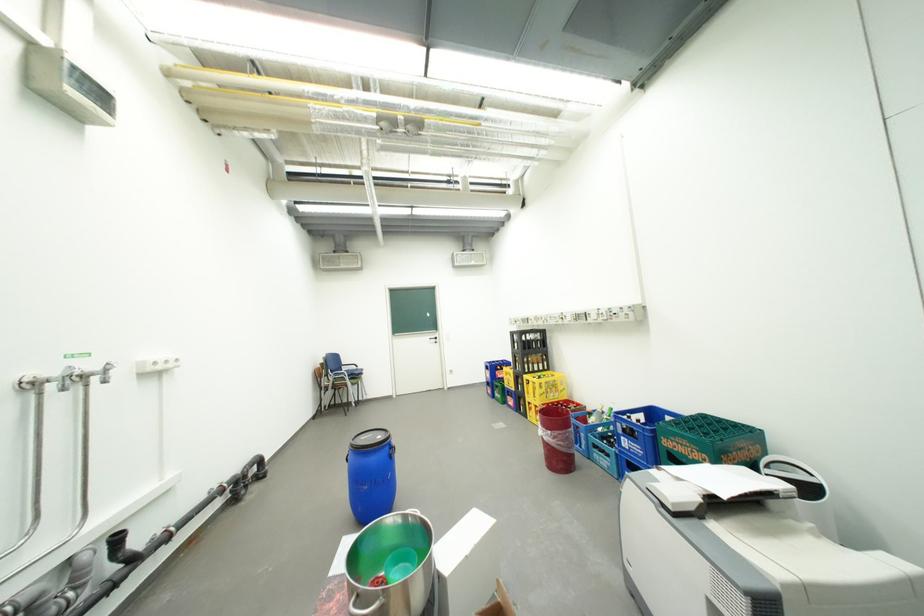
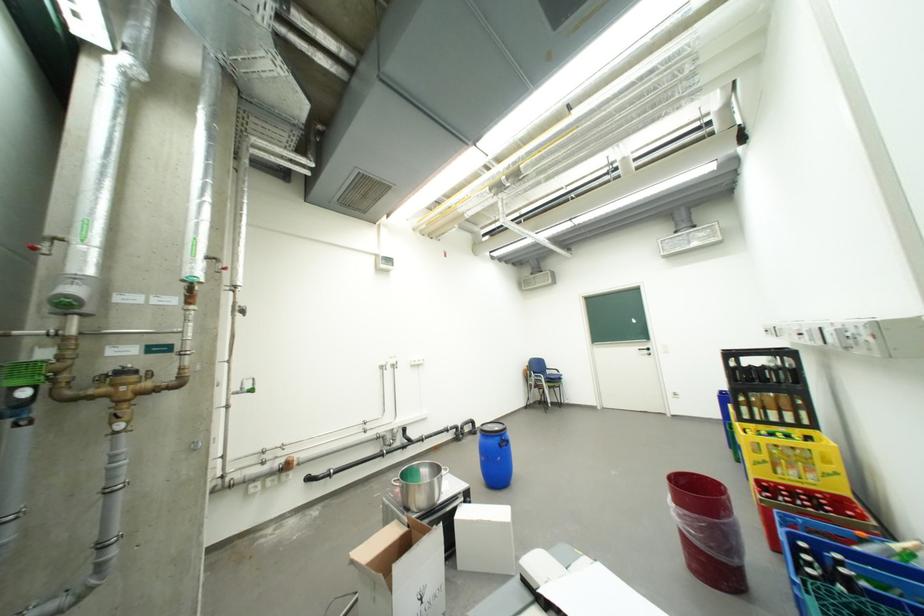
Where in the second image is the point corresponding to point (565, 400) from the first image?

(810, 484)